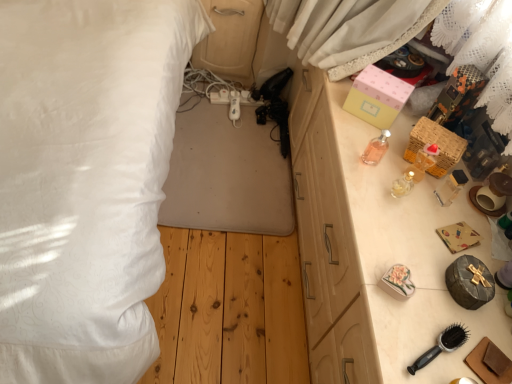
Image resolution: width=512 pixels, height=384 pixels. In order to click on blank area to the left of black plastic hairbrush at lower right in this screenshot , I will do `click(384, 326)`.